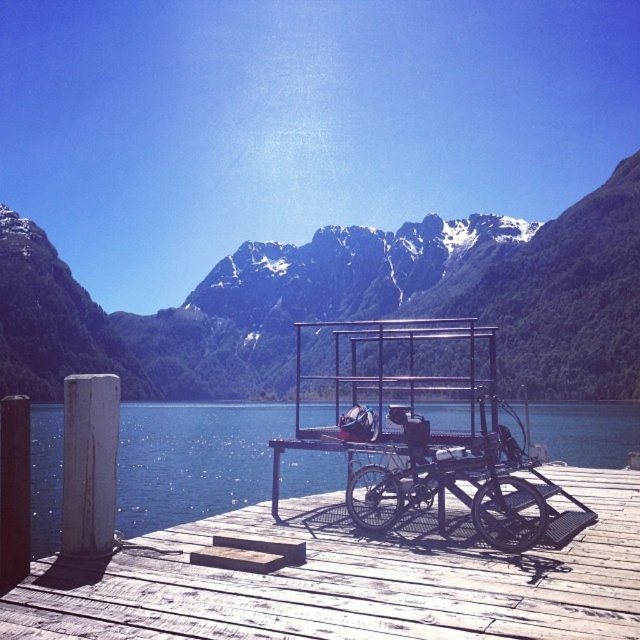
Question: Which point is farther from the camera taking this photo?

Choices:
 (A) (604, 595)
 (B) (272, 369)
 (C) (396, 468)

Answer: (B)

Question: Is snowy rock mountain at upper center to the right of wooden dock at center from the viewer's perspective?

Choices:
 (A) no
 (B) yes

Answer: (A)

Question: Does snowy rock mountain at upper center appear on the left side of blue water at center?

Choices:
 (A) no
 (B) yes

Answer: (B)

Question: Does wooden dock at center have a greater width compared to black matte bicycle at center?

Choices:
 (A) yes
 (B) no

Answer: (A)

Question: Which point is closer to the camera?

Choices:
 (A) snowy rock mountain at upper center
 (B) wooden dock at center
 (C) black matte bicycle at center
 (D) blue water at center

Answer: (B)

Question: Among these points, which one is farthest from the camera?

Choices:
 (A) (134, 442)
 (B) (237, 392)
 (C) (353, 608)
 (D) (348, 512)

Answer: (B)